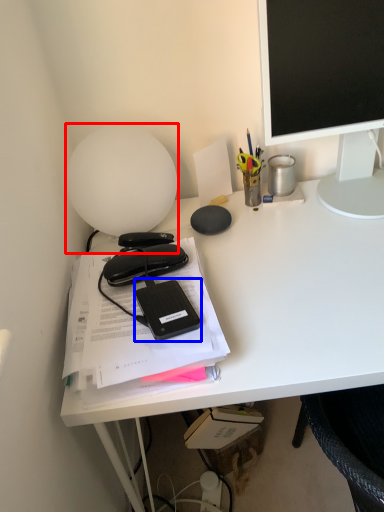
Question: Which point is closer to the camera, lamp (highlighted by a red box) or equipment (highlighted by a blue box)?

Choices:
 (A) lamp
 (B) equipment

Answer: (B)